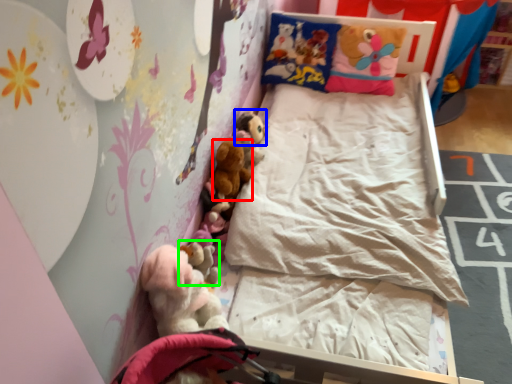
Question: Which is farther away from toy (highlighted by a red box)? toy (highlighted by a blue box) or toy (highlighted by a green box)?

Choices:
 (A) toy
 (B) toy

Answer: (B)